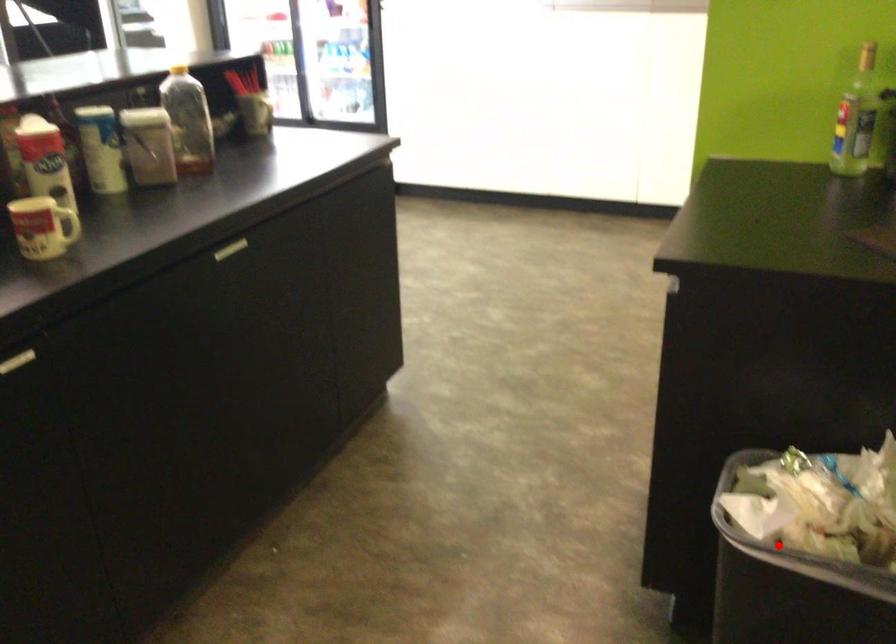
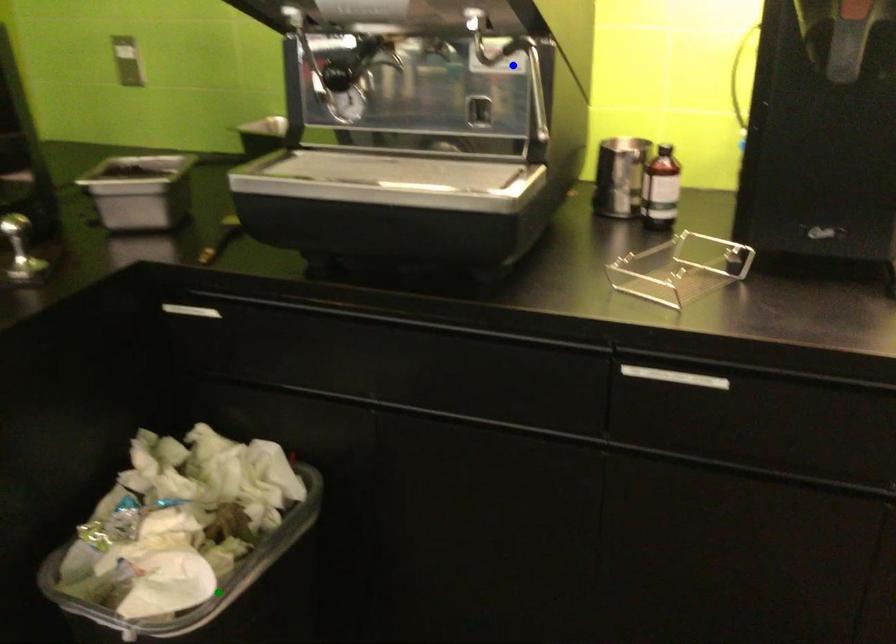
Question: I am providing you with two images of the same scene from different viewpoints. A red point is marked on the first image. You are given multiple points on the second image. Which point in image 2 represents the same 3d spot as the red point in image 1?

Choices:
 (A) blue point
 (B) yellow point
 (C) green point

Answer: (C)